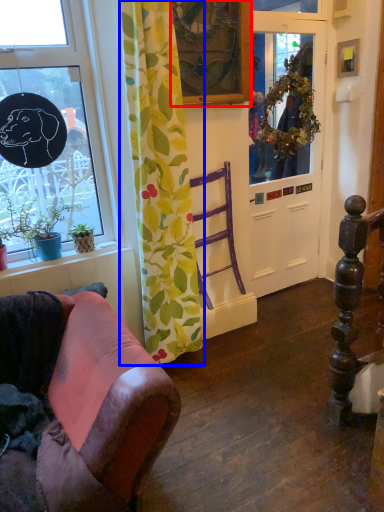
Question: Which object is closer to the camera taking this photo, picture frame (highlighted by a red box) or curtain (highlighted by a blue box)?

Choices:
 (A) picture frame
 (B) curtain

Answer: (B)